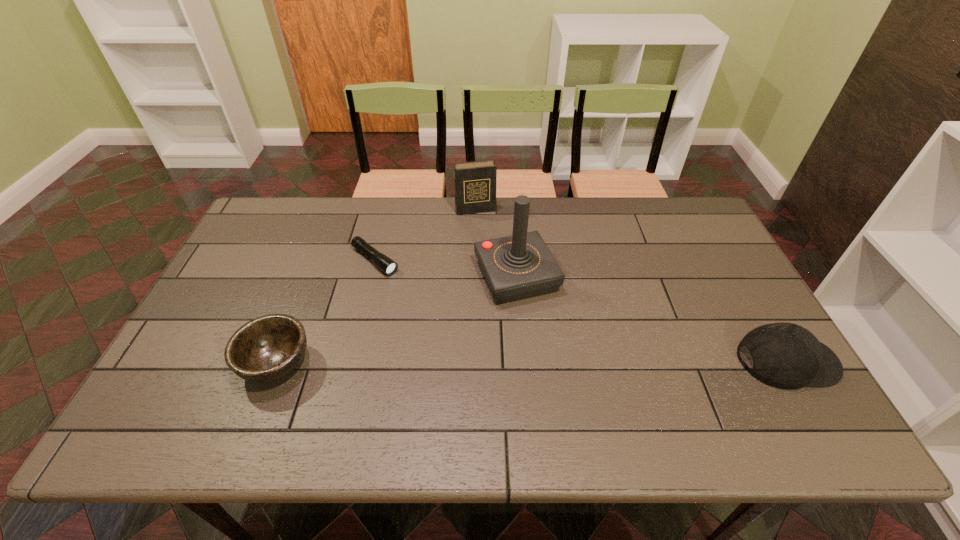
At what (x,y) coordinates should I click in order to perform the action: click on free region located 0.300m at the lens end of the second object from left to right. Please return your answer as a coordinate pair (x, y). Looking at the image, I should click on (461, 327).

The height and width of the screenshot is (540, 960). I want to click on free spot located 0.060m at the lens end of the second object from left to right, so click(x=404, y=282).

The width and height of the screenshot is (960, 540). Identify the location of free space located at the lens end of the second object from left to right. (467, 332).

Identify the location of vacant space located on the rectangular base of the joystick. The width and height of the screenshot is (960, 540). (566, 376).

This screenshot has width=960, height=540. In order to click on free region located 0.210m on the rectangular base of the joystick in this screenshot , I will do `click(563, 369)`.

Locate an element on the screen. This screenshot has height=540, width=960. vacant space located 0.060m on the rectangular base of the joystick is located at coordinates (540, 323).

Where is `vacant space located on the front cover of the second tallest object`? Image resolution: width=960 pixels, height=540 pixels. vacant space located on the front cover of the second tallest object is located at coordinates (498, 283).

The height and width of the screenshot is (540, 960). What are the coordinates of `vacant position located 0.070m on the front cover of the second tallest object` in the screenshot? It's located at click(483, 228).

What are the coordinates of `free location located on the front cover of the second tallest object` in the screenshot? It's located at (485, 235).

Where is `object situated at the far edge`? object situated at the far edge is located at coordinates (474, 182).